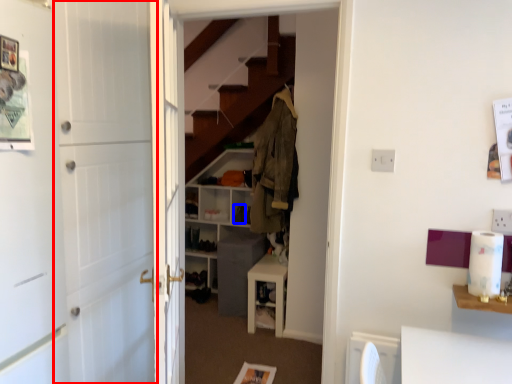
Question: Which of the following is the farthest to the observer, barn door (highlighted by a red box) or shoe (highlighted by a blue box)?

Choices:
 (A) barn door
 (B) shoe

Answer: (B)